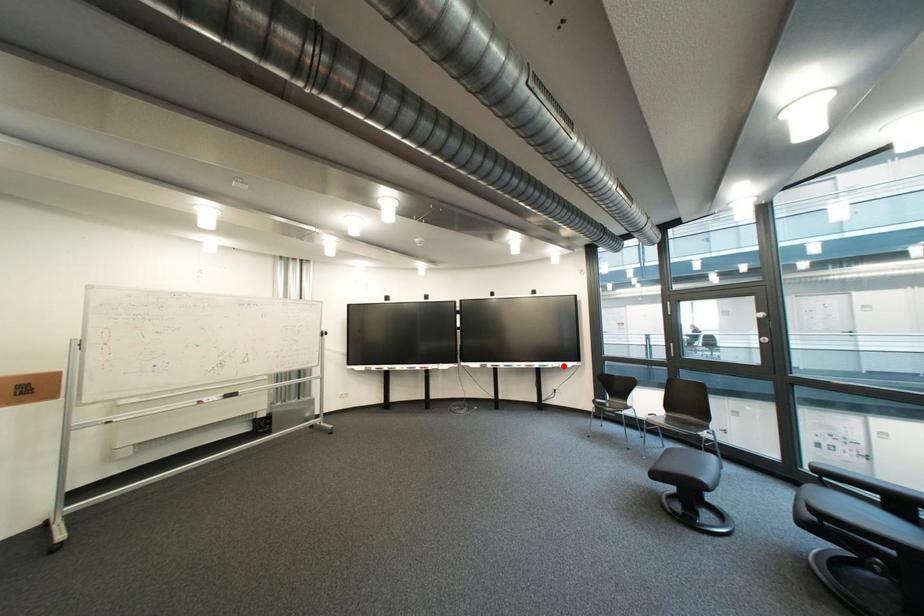
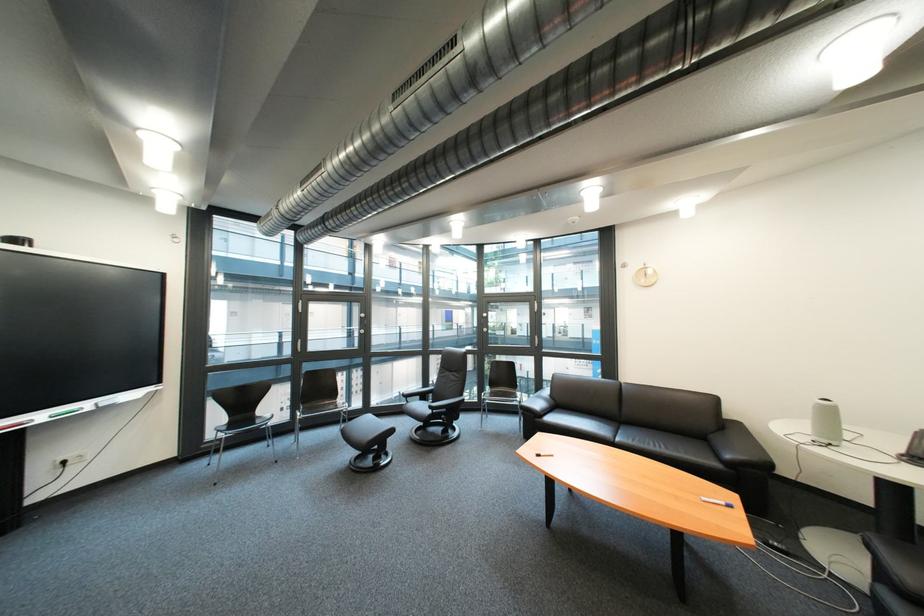
Where in the second image is the point corresponding to the highlighted location from the first image?

(101, 406)